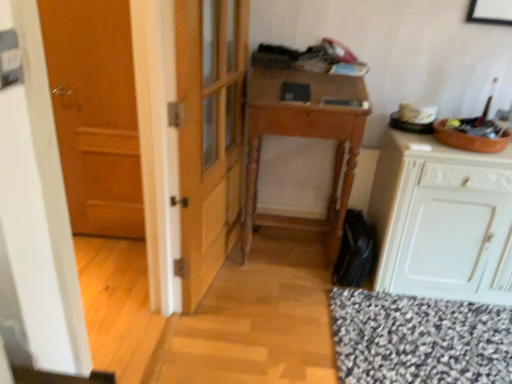
This screenshot has width=512, height=384. What do you see at coordinates (305, 137) in the screenshot?
I see `wooden desk at center` at bounding box center [305, 137].

The image size is (512, 384). Find the location of `wooden desk at center`. wooden desk at center is located at coordinates (305, 137).

Where is `wooden desk at center`? Image resolution: width=512 pixels, height=384 pixels. wooden desk at center is located at coordinates (305, 137).

Is there a large distance between white painted wood cabinet at right and wooden door at left?

Indeed, white painted wood cabinet at right is not near wooden door at left.

Is point (440, 234) closer or farther from the camera than point (113, 21)?

Point (440, 234) is farther from the camera than point (113, 21).

Is white painted wood cabinet at right facing away from wooden door at left?

No, white painted wood cabinet at right's orientation is not away from wooden door at left.

Image resolution: width=512 pixels, height=384 pixels. I want to click on cabinetry below the wooden desk at center (from the image's perspective), so click(x=442, y=220).

Is white painted wood cabinet at right facing away from wooden desk at center?

No, white painted wood cabinet at right is not facing away from wooden desk at center.

Considering the positions of objects white painted wood cabinet at right and wooden desk at center in the image provided, who is more to the right, white painted wood cabinet at right or wooden desk at center?

From the viewer's perspective, white painted wood cabinet at right appears more on the right side.

Which is correct: wooden desk at center is inside wooden door at left, or outside of it?

wooden desk at center is outside wooden door at left.

Is wooden desk at center next to wooden door at left and touching it?

wooden desk at center is not next to wooden door at left, and they're not touching.

Can you confirm if wooden desk at center is positioned to the right of wooden door at left?

Yes.

From the image's perspective, is wooden desk at center positioned above or below white painted wood cabinet at right?

wooden desk at center is above white painted wood cabinet at right.

Looking at this image, from a real-world perspective, is wooden desk at center beneath white painted wood cabinet at right?

No.

Which object is closer to the camera, wooden desk at center or white painted wood cabinet at right?

white painted wood cabinet at right is in front.

Is wooden desk at center positioned beyond the bounds of white painted wood cabinet at right?

Yes, wooden desk at center is located beyond the bounds of white painted wood cabinet at right.

Is wooden door at left bigger than wooden desk at center?

No, wooden door at left is not bigger than wooden desk at center.

Is wooden door at left positioned beyond the bounds of wooden desk at center?

Indeed, wooden door at left is completely outside wooden desk at center.

From a real-world perspective, is wooden door at left under wooden desk at center?

No, from a real-world perspective, wooden door at left is not below wooden desk at center.

Locate an element on the screen. The image size is (512, 384). table that is under the wooden door at left (from a real-world perspective) is located at coordinates (305, 137).

This screenshot has width=512, height=384. I want to click on door above the white painted wood cabinet at right (from a real-world perspective), so [95, 113].

Considering their positions, is wooden door at left located in front of or behind white painted wood cabinet at right?

Visually, wooden door at left is located behind white painted wood cabinet at right.

From a real-world perspective, is wooden door at left positioned above or below white painted wood cabinet at right?

Clearly, from a real-world perspective, wooden door at left is above white painted wood cabinet at right.

Is wooden door at left inside the boundaries of white painted wood cabinet at right, or outside?

wooden door at left exists outside the volume of white painted wood cabinet at right.

The image size is (512, 384). I want to click on door above the white painted wood cabinet at right (from a real-world perspective), so coord(95,113).

Image resolution: width=512 pixels, height=384 pixels. Find the location of `cabinetry in front of the wooden desk at center`. cabinetry in front of the wooden desk at center is located at coordinates (442, 220).

Which object lies nearer to the anchor point wooden door at left, wooden desk at center or white painted wood cabinet at right?

Based on the image, wooden desk at center appears to be nearer to wooden door at left.

Which object lies nearer to the anchor point wooden desk at center, white painted wood cabinet at right or wooden door at left?

Based on the image, white painted wood cabinet at right appears to be nearer to wooden desk at center.

When comparing their distances from wooden desk at center, does wooden door at left or white painted wood cabinet at right seem further?

wooden door at left.

Looking at the image, which one is located closer to white painted wood cabinet at right, wooden door at left or wooden desk at center?

Based on the image, wooden desk at center appears to be nearer to white painted wood cabinet at right.

Looking at the image, which one is located closer to white painted wood cabinet at right, wooden desk at center or wooden door at left?

Among the two, wooden desk at center is located nearer to white painted wood cabinet at right.

Which object lies further to the anchor point wooden door at left, white painted wood cabinet at right or wooden desk at center?

white painted wood cabinet at right lies further to wooden door at left than the other object.

Find the location of a particular element. The height and width of the screenshot is (384, 512). table between wooden door at left and white painted wood cabinet at right is located at coordinates (305, 137).